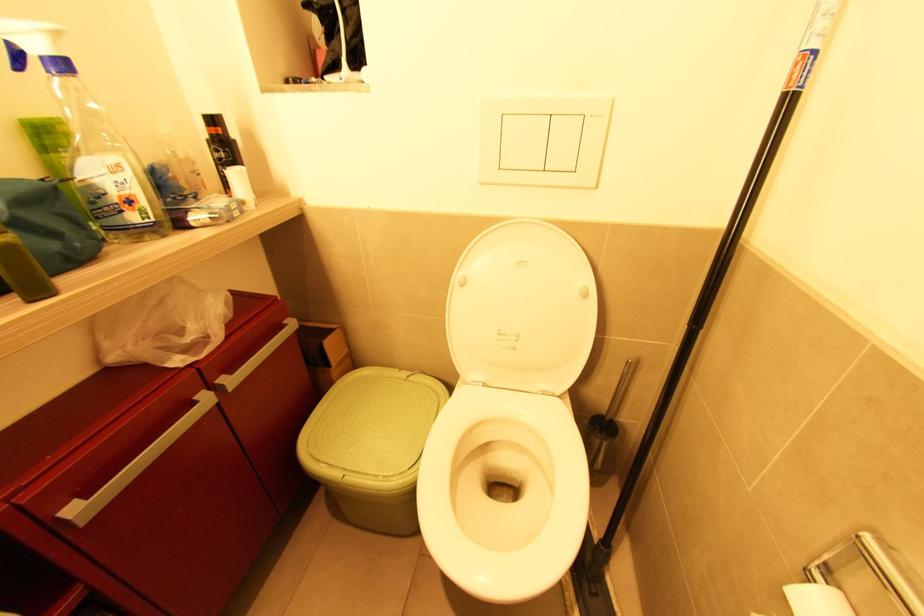
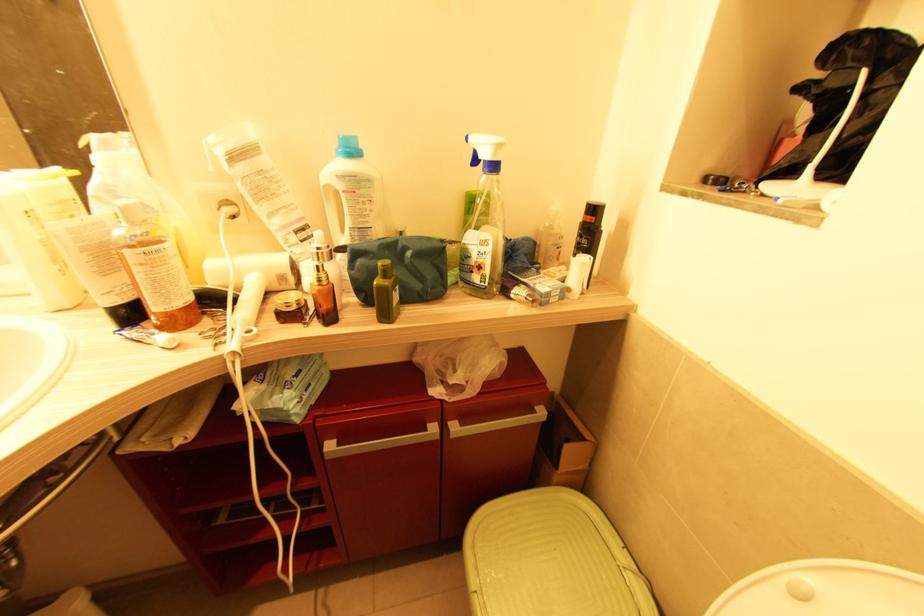
Locate, in the second image, the point that corresponds to the point at 124,213 in the first image.

(473, 273)